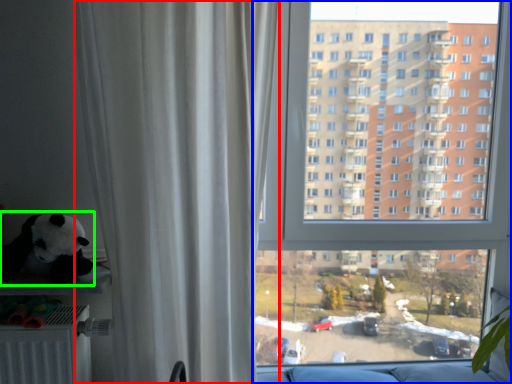
Question: Based on their relative distances, which object is nearer to curtain (highlighted by a red box)? Choose from window (highlighted by a blue box) and toy (highlighted by a green box).

Choices:
 (A) window
 (B) toy

Answer: (B)